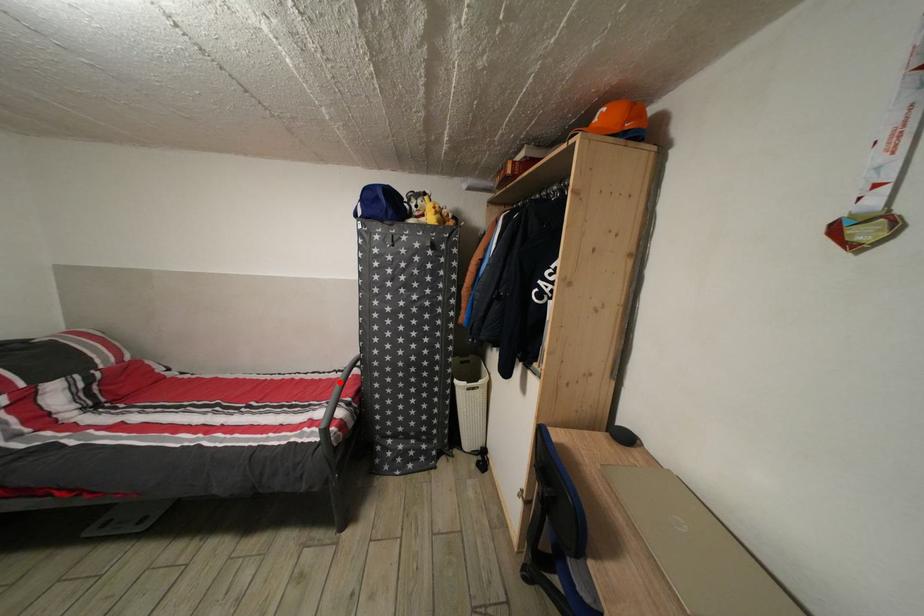
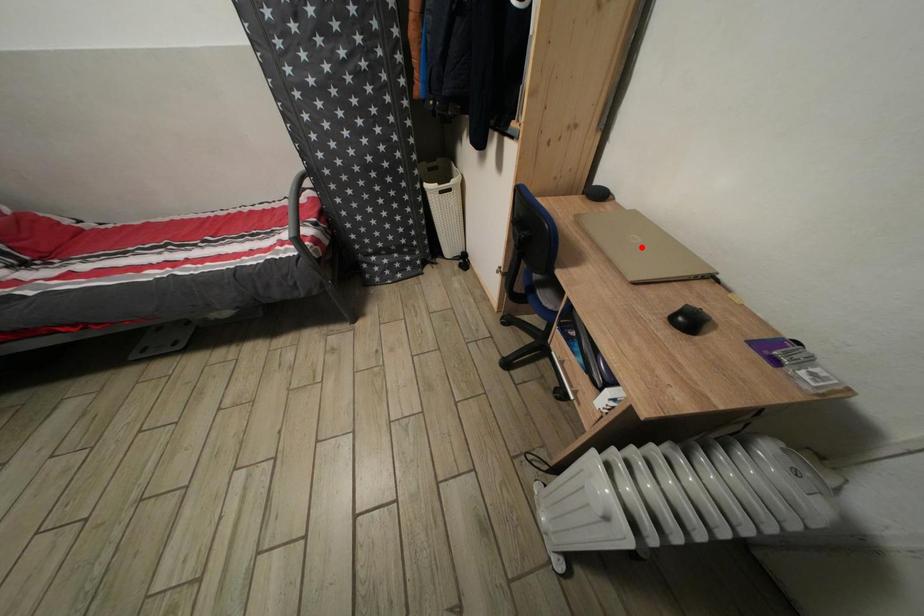
I am providing you with two images of the same scene from different viewpoints. A red point is marked on the first image and another point is marked on the second image. Is the marked point in image1 the same physical position as the marked point in image2?

No